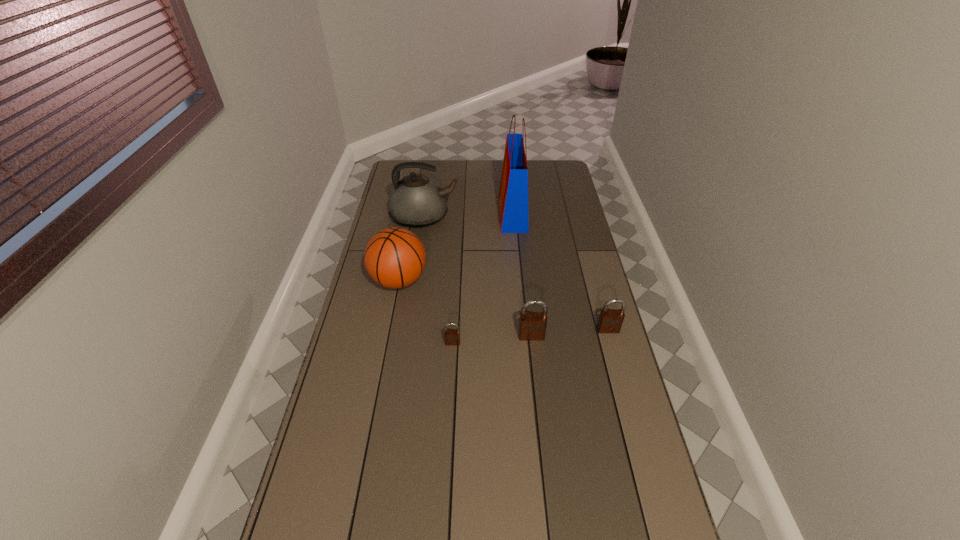
Where is `blank region between the fourth nearest object and the fifth tallest object`? The height and width of the screenshot is (540, 960). blank region between the fourth nearest object and the fifth tallest object is located at coordinates (504, 305).

Where is `free space between the third tallest object and the second padlock from left to right`? This screenshot has width=960, height=540. free space between the third tallest object and the second padlock from left to right is located at coordinates (466, 308).

Locate an element on the screen. empty location between the shortest object and the second padlock from left to right is located at coordinates (492, 340).

I want to click on object that is the second closest one to the shortest padlock, so click(x=394, y=257).

Find the location of a particular element. object that ranks as the third closest to the shopping bag is located at coordinates (532, 326).

The height and width of the screenshot is (540, 960). Find the location of `padlock that is the second closest to the kettle`. padlock that is the second closest to the kettle is located at coordinates (532, 326).

This screenshot has width=960, height=540. I want to click on padlock that is the closest to the second tallest object, so click(452, 336).

I want to click on free location that satisfies the following two spatial constraints: 1. on the handle side of the tallest object; 2. on the front-facing side of the shortest padlock, so click(525, 343).

In order to click on free spot that satisfies the following two spatial constraints: 1. on the handle side of the shopping bag; 2. on the front-facing side of the leftmost padlock in this screenshot , I will do `click(525, 343)`.